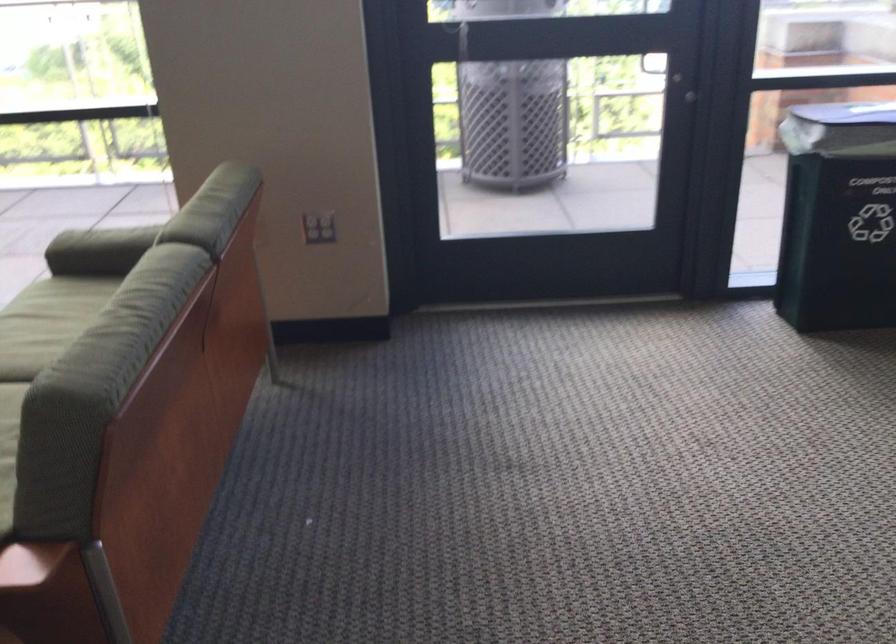
Identify the location of power outlet socket. (319, 227).